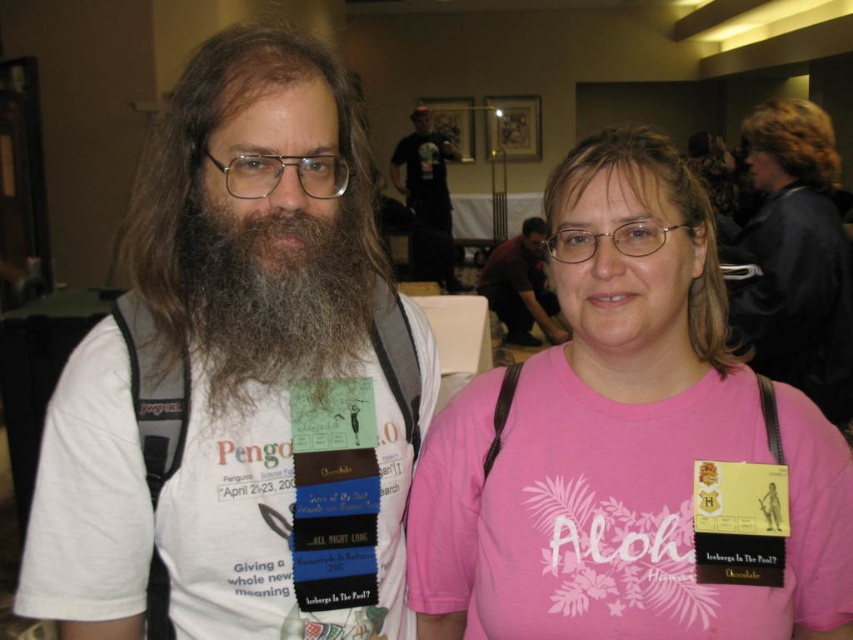
Question: Estimate the real-world distances between objects in this image. Which object is closer to the brown matte hair at center?

Choices:
 (A) brown fuzzy beard at left
 (B) blonde hair at upper right
 (C) light brown hair at center

Answer: (B)

Question: Does brown fuzzy beard at left appear on the left side of brown matte hair at center?

Choices:
 (A) no
 (B) yes

Answer: (B)

Question: Among these points, which one is nearest to the camera?

Choices:
 (A) (717, 365)
 (B) (535, 234)

Answer: (A)

Question: Which of the following is the farthest from the observer?

Choices:
 (A) brown matte hair at center
 (B) blonde hair at upper right

Answer: (A)

Question: Does brownwoollyhair at left have a smaller size compared to light brown hair at center?

Choices:
 (A) no
 (B) yes

Answer: (A)

Question: Can you confirm if brownwoollyhair at left is positioned above dark brown leather jacket at center?

Choices:
 (A) no
 (B) yes

Answer: (A)